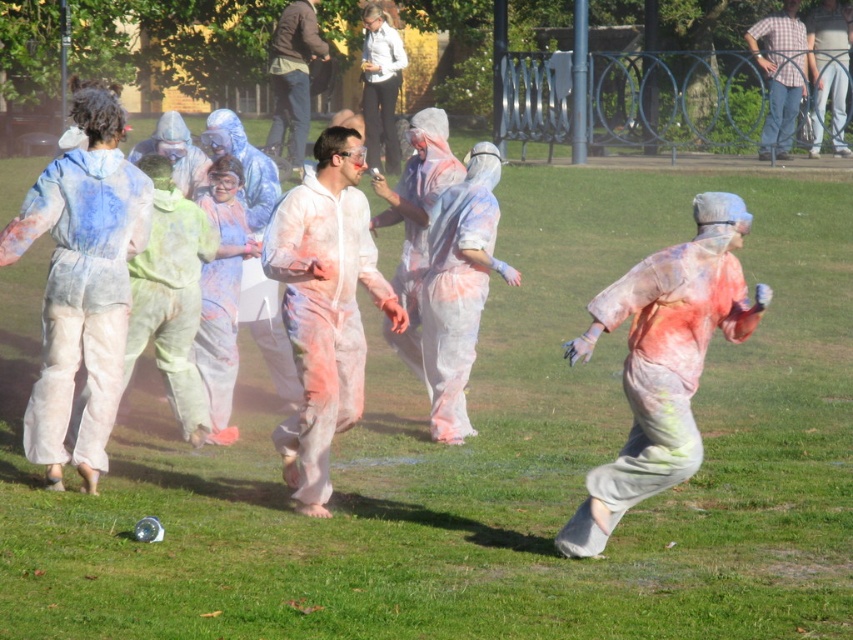
Question: Which object is positioned farthest from the speckled fabric man at center?

Choices:
 (A) brown leather jacket at upper center
 (B) white matte jumpsuit at center
 (C) plaid shirt at upper right

Answer: (C)

Question: Is speckled fabric man at center bigger than plaid shirt at upper right?

Choices:
 (A) yes
 (B) no

Answer: (B)

Question: Can you confirm if white matte jumpsuit at center is positioned below brown leather jacket at upper center?

Choices:
 (A) yes
 (B) no

Answer: (A)

Question: Among these points, which one is farthest from the camera?

Choices:
 (A) (630, 380)
 (B) (296, 129)
 (C) (770, 28)

Answer: (C)

Question: Can you confirm if speckled fabric man at center is smaller than plaid shirt at upper right?

Choices:
 (A) yes
 (B) no

Answer: (A)

Question: Which point appears closest to the camera in this image?

Choices:
 (A) (357, 161)
 (B) (689, 298)
 (C) (793, 109)
 (D) (283, 92)

Answer: (B)